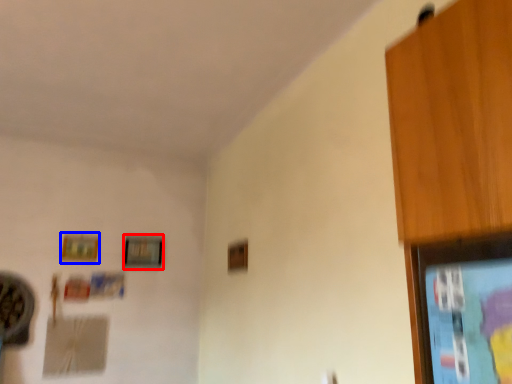
Question: Which object appears closest to the camera in this image, picture frame (highlighted by a red box) or picture frame (highlighted by a blue box)?

Choices:
 (A) picture frame
 (B) picture frame

Answer: (B)